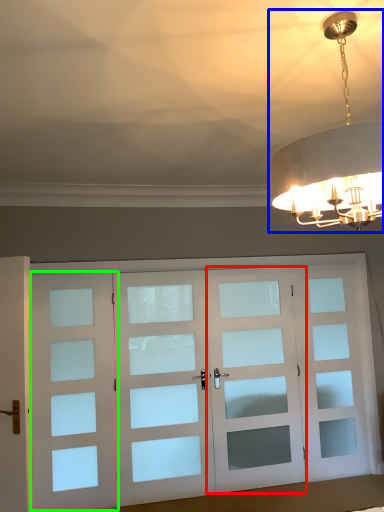
Question: Which object is the farthest from screen door (highlighted by a red box)? Choose among these: lamp (highlighted by a blue box) or screen door (highlighted by a green box).

Choices:
 (A) lamp
 (B) screen door

Answer: (A)